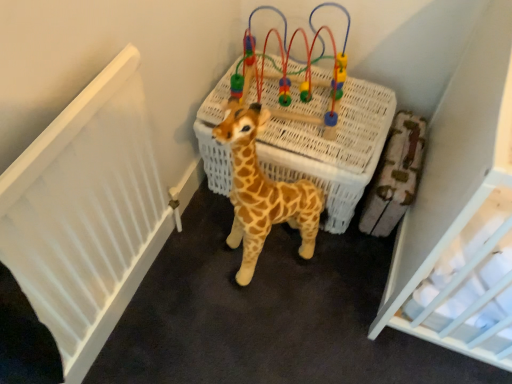
Identify the location of free spot in front of spotted plush giraffe at center. The image size is (512, 384). (257, 326).